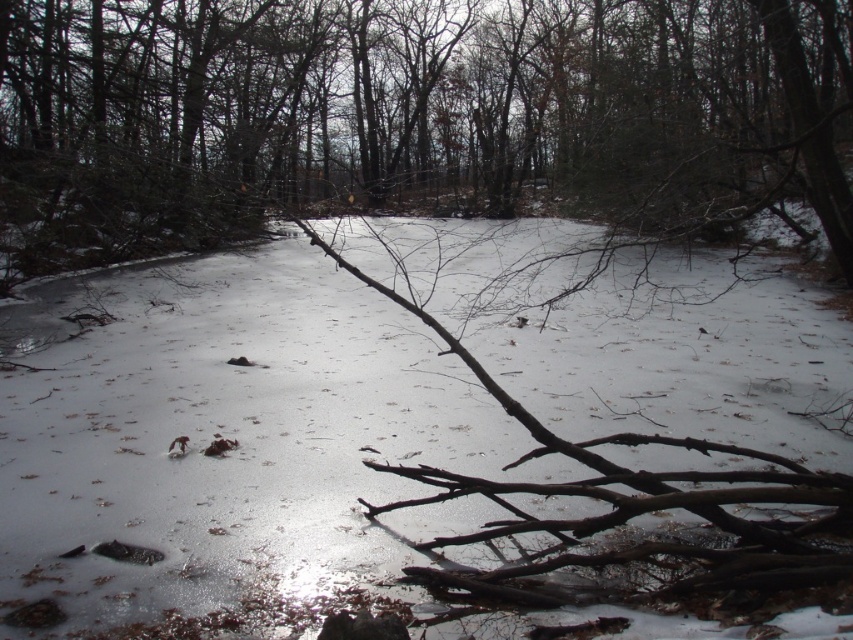
Which is above, white matte snow at center or brown rough branch at center?

brown rough branch at center is above.

The height and width of the screenshot is (640, 853). Identify the location of white matte snow at center. (231, 435).